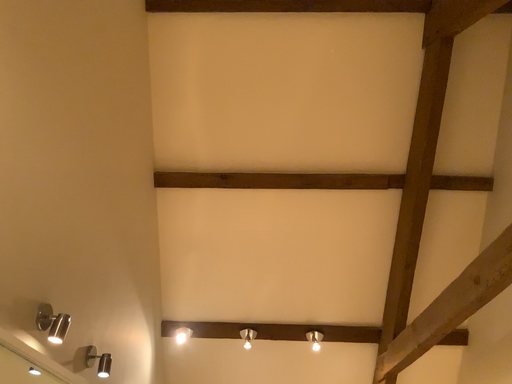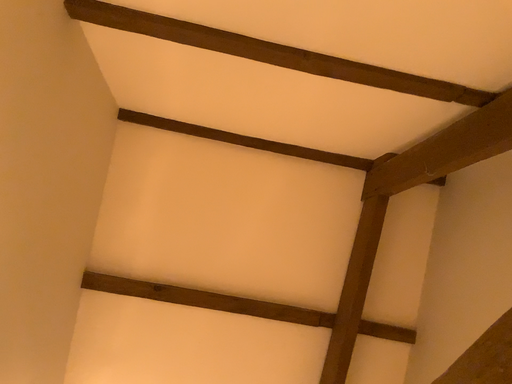
Question: Which way did the camera rotate in the video?

Choices:
 (A) rotated right
 (B) rotated left

Answer: (A)